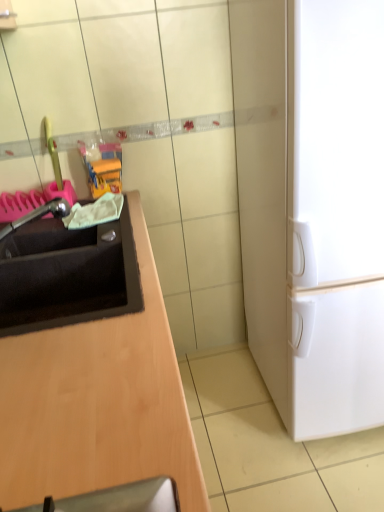
The width and height of the screenshot is (384, 512). In order to click on unoccupied space behind satin nickel faucet at left in this screenshot , I will do `click(41, 228)`.